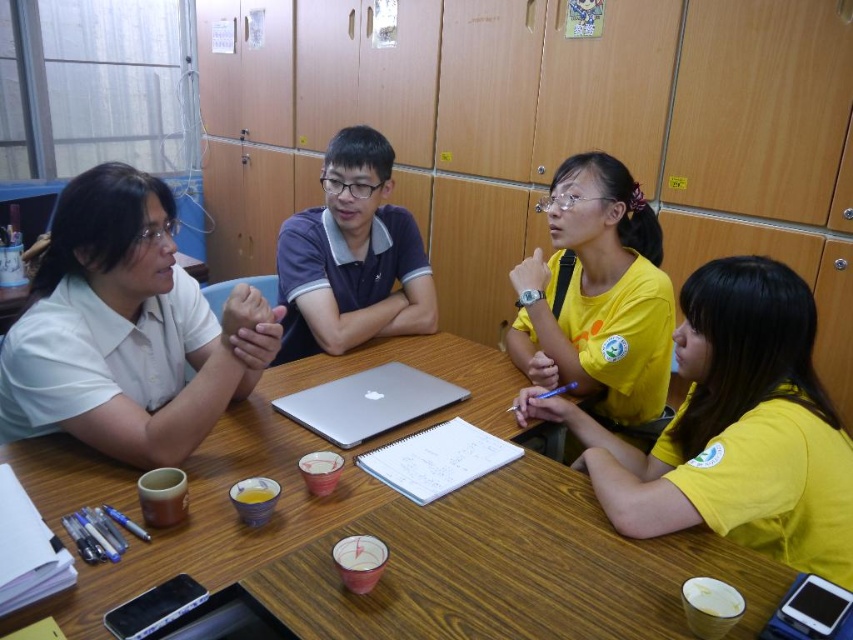
Which is more to the left, dark blue polo shirt at center or sleek silver laptop at center?

dark blue polo shirt at center

Is dark blue polo shirt at center to the right of sleek silver laptop at center from the viewer's perspective?

In fact, dark blue polo shirt at center is to the left of sleek silver laptop at center.

Who is more forward, (386, 163) or (334, 440)?

Point (334, 440)

Identify the location of dark blue polo shirt at center. The image size is (853, 640). (351, 257).

How much distance is there between wooden table at center and dark blue polo shirt at center?

17.27 inches

In the scene shown: Is wooden table at center further to the viewer compared to dark blue polo shirt at center?

No, wooden table at center is in front of dark blue polo shirt at center.

Who is more distant from viewer, [543,460] or [310,326]?

The point [310,326] is behind.

Identify the location of wooden table at center. This screenshot has width=853, height=640. (416, 534).

Between point (38, 412) and point (404, 288), which one is positioned in front?

Positioned in front is point (38, 412).

Is white matte shirt at upper left thinner than dark blue polo shirt at center?

In fact, white matte shirt at upper left might be wider than dark blue polo shirt at center.

Does point (265, 339) lie in front of point (384, 212)?

Yes, point (265, 339) is in front of point (384, 212).

Find the location of a particular element. white matte shirt at upper left is located at coordinates (126, 330).